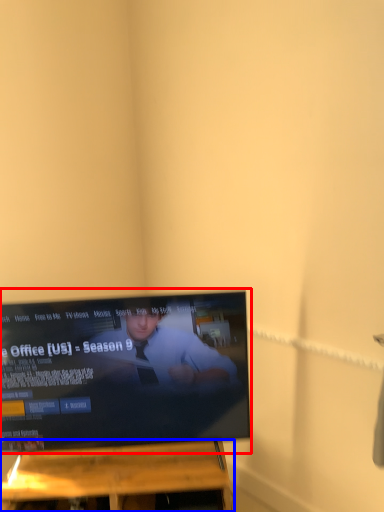
Question: Which of the following is the closest to the observer, television (highlighted by a red box) or furniture (highlighted by a blue box)?

Choices:
 (A) television
 (B) furniture

Answer: (A)